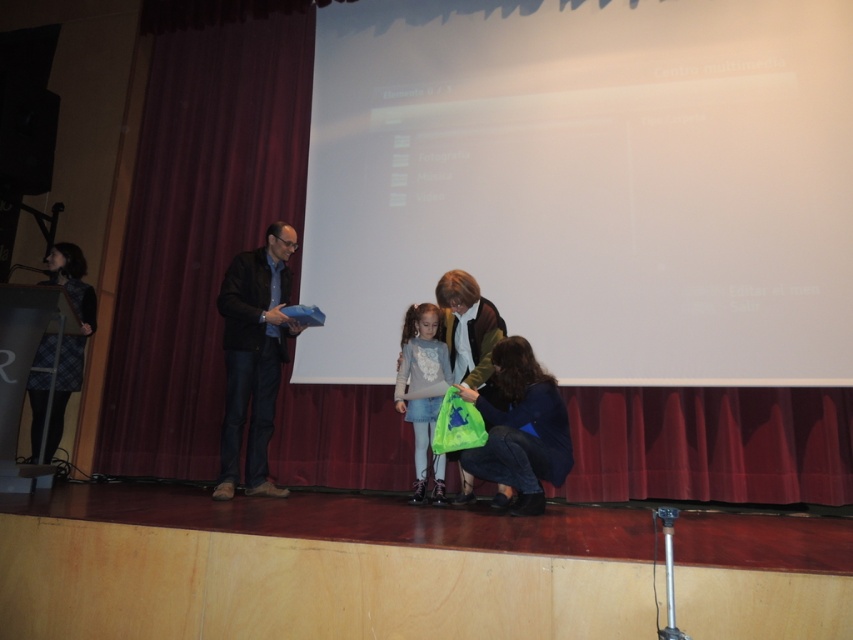
Question: Based on their relative distances, which object is farther from the maroon velvet curtain at left?

Choices:
 (A) white matte projection screen at center
 (B) green fabric bag at lower center

Answer: (B)

Question: Is maroon velvet curtain at left positioned before dark brown leather jacket at center?

Choices:
 (A) yes
 (B) no

Answer: (B)

Question: Is the position of green fabric bag at lower center less distant than that of matte green jacket at center?

Choices:
 (A) no
 (B) yes

Answer: (B)

Question: Does maroon velvet curtain at left appear on the left side of matte gray sweater at center?

Choices:
 (A) no
 (B) yes

Answer: (B)

Question: Which object appears closest to the camera in this image?

Choices:
 (A) plaid fabric dress at left
 (B) white matte projection screen at center
 (C) matte gray sweater at center
 (D) maroon velvet curtain at left

Answer: (B)

Question: Which point is farther to the camera?

Choices:
 (A) (544, 429)
 (B) (181, 3)
 (C) (500, 502)
 (D) (45, 384)

Answer: (B)